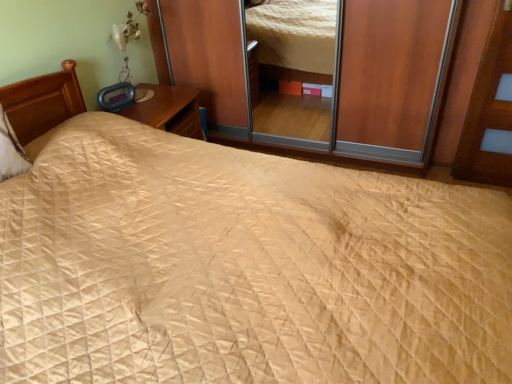
You are a GUI agent. You are given a task and a screenshot of the screen. Output one action in this format:
    pyautogui.click(x=<x>, y=<y>)
    Task: Click on the matte brown bed at upper center
    
    Given the screenshot: What is the action you would take?
    pyautogui.click(x=321, y=76)

Describe the element at coordinates (321, 76) in the screenshot. I see `matte brown bed at upper center` at that location.

Where is `matte brown bed at upper center`? The image size is (512, 384). matte brown bed at upper center is located at coordinates (321, 76).